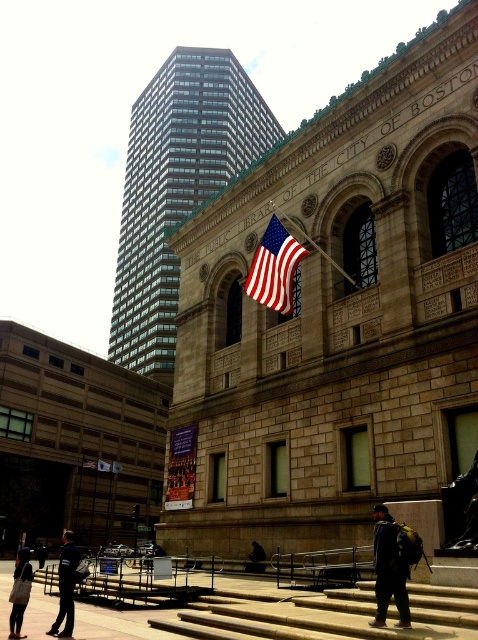
Question: Which of the following is the farthest from the observer?

Choices:
 (A) stone stairs at center
 (B) american flag at center
 (C) dark blue uniform at lower left
 (D) dark gray sweater at lower left

Answer: (B)

Question: Among these points, which one is nearest to the camera?

Choices:
 (A) (387, 516)
 (B) (66, 605)
 (C) (289, 256)

Answer: (B)

Question: Is stone stairs at center below dark gray sweater at lower left?

Choices:
 (A) yes
 (B) no

Answer: (B)

Question: Does stone stairs at center have a lesser width compared to dark gray sweater at lower left?

Choices:
 (A) yes
 (B) no

Answer: (A)

Question: Among these points, which one is farthest from the camera?

Choices:
 (A) pos(393,548)
 (B) pos(256,556)
 (C) pos(269,260)
 (D) pos(65,600)

Answer: (B)

Question: In this image, where is dark blue jacket at lower right located relative to dark blue jacket at lower center?

Choices:
 (A) below
 (B) above

Answer: (B)